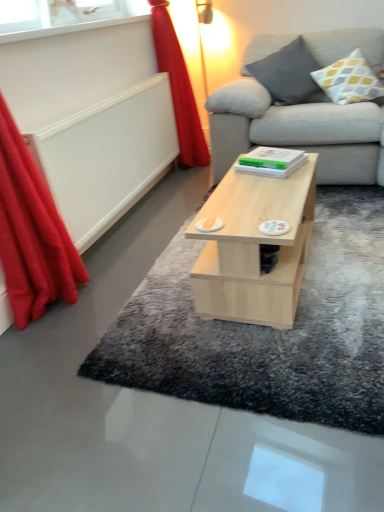
Question: Looking at the image, does light gray shaggy rug at center seem bigger or smaller compared to light wood coffee table at center?

Choices:
 (A) small
 (B) big

Answer: (A)

Question: From the image's perspective, is light gray shaggy rug at center above or below light wood coffee table at center?

Choices:
 (A) above
 (B) below

Answer: (B)

Question: Which is farther from the transparent glass window at upper left?

Choices:
 (A) red velvet curtain at left, which is counted as the second curtain, starting from the front
 (B) light gray shaggy rug at center
 (C) yellow and gray dotted pillow at upper right, acting as the 1th pillow starting from the right
 (D) red fabric curtain at left, which ranks as the 2th curtain in right-to-left order
 (E) light wood coffee table at center

Answer: (B)

Question: Which object is the farthest from the gray fabric pillow at upper right, the first pillow in the left-to-right sequence?

Choices:
 (A) light gray shaggy rug at center
 (B) red fabric curtain at left, which ranks as the second curtain in back-to-front order
 (C) red velvet curtain at left, which ranks as the 2th curtain in left-to-right order
 (D) transparent glass window at upper left
 (E) yellow and gray dotted pillow at upper right, placed as the second pillow when sorted from left to right

Answer: (B)